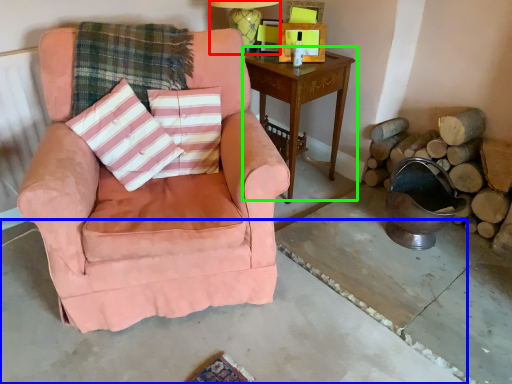
Question: Estimate the real-world distances between objects in this image. Which object is farther from table lamp (highlighted by a red box), concrete (highlighted by a blue box) or nightstand (highlighted by a green box)?

Choices:
 (A) concrete
 (B) nightstand

Answer: (A)